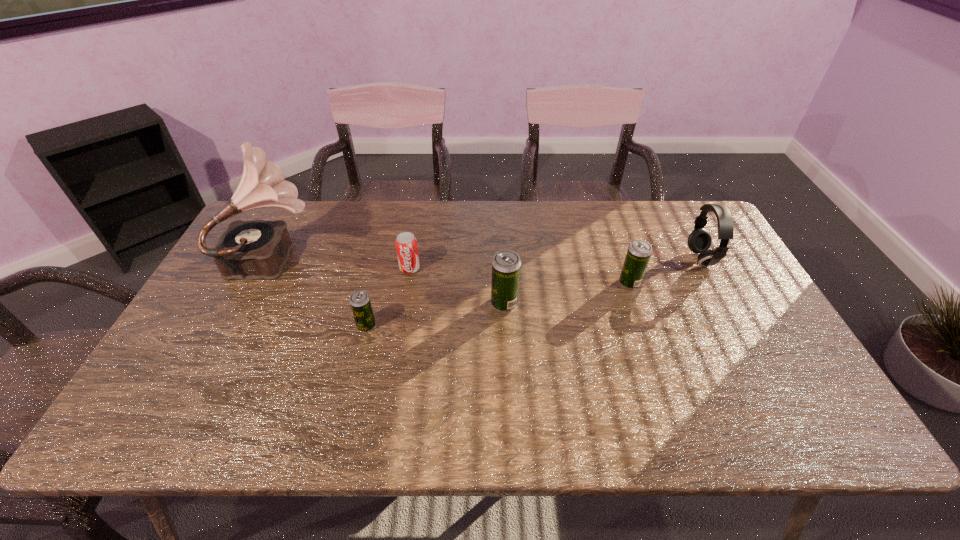
At what (x,y) coordinates should I click in order to perform the action: click on object that is at the left edge. Please return your answer as a coordinate pair (x, y). Looking at the image, I should click on [258, 249].

Identify the location of object positioned at the right edge. The width and height of the screenshot is (960, 540). (699, 241).

Locate an element on the screen. object located in the far left corner section of the desktop is located at coordinates (258, 249).

Locate an element on the screen. object that is at the far right corner is located at coordinates (699, 241).

I want to click on blank space at the far edge of the desktop, so click(367, 201).

Image resolution: width=960 pixels, height=540 pixels. In the image, there is a desktop. Find the location of `vacant space at the near edge`. vacant space at the near edge is located at coordinates (678, 393).

Find the location of a particular element. The height and width of the screenshot is (540, 960). free spot at the left edge of the desktop is located at coordinates (247, 328).

I want to click on free space at the right edge, so click(685, 266).

In the image, there is a desktop. Where is `vacant space at the far left corner`? The height and width of the screenshot is (540, 960). vacant space at the far left corner is located at coordinates (291, 222).

The image size is (960, 540). In the image, there is a desktop. In order to click on vacant area at the near left corner in this screenshot , I will do `click(204, 366)`.